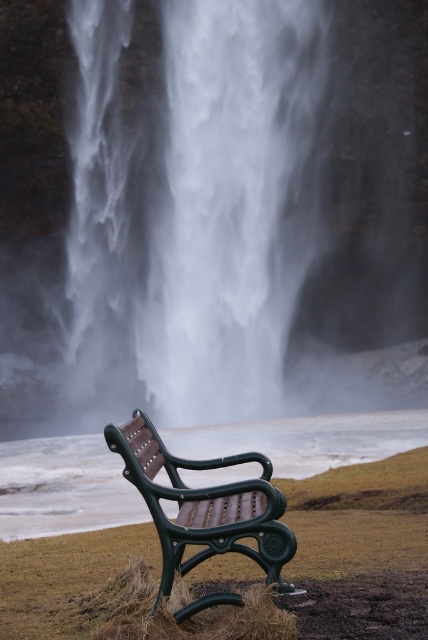
Question: Does white misty waterfall at center appear on the right side of green plastic bench at lower center?

Choices:
 (A) no
 (B) yes

Answer: (A)

Question: Where is white misty waterfall at center located in relation to green plastic bench at lower center in the image?

Choices:
 (A) right
 (B) left

Answer: (B)

Question: Which of these objects is positioned farthest from the white misty waterfall at center?

Choices:
 (A) translucent mist at bench center
 (B) green plastic bench at lower center

Answer: (B)

Question: Which object appears farthest from the camera in this image?

Choices:
 (A) translucent mist at bench center
 (B) white misty waterfall at center
 (C) green plastic bench at lower center

Answer: (B)

Question: Which of the following is the farthest from the observer?

Choices:
 (A) (380, 432)
 (B) (264, 19)

Answer: (B)

Question: Does translucent mist at bench center lie in front of green plastic bench at lower center?

Choices:
 (A) yes
 (B) no

Answer: (B)